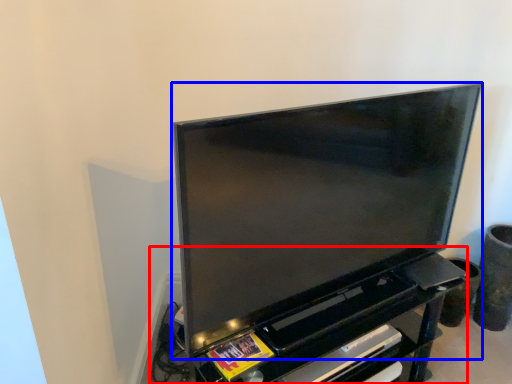
Question: Which object appears farthest to the camera in this image, entertainment center (highlighted by a red box) or television (highlighted by a blue box)?

Choices:
 (A) entertainment center
 (B) television

Answer: (A)